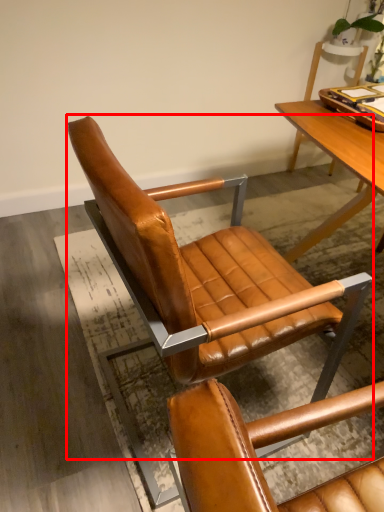
Question: From the image's perspective, what is the correct spatial positioning of chair (annotated by the red box) in reference to tray?

Choices:
 (A) below
 (B) above

Answer: (A)